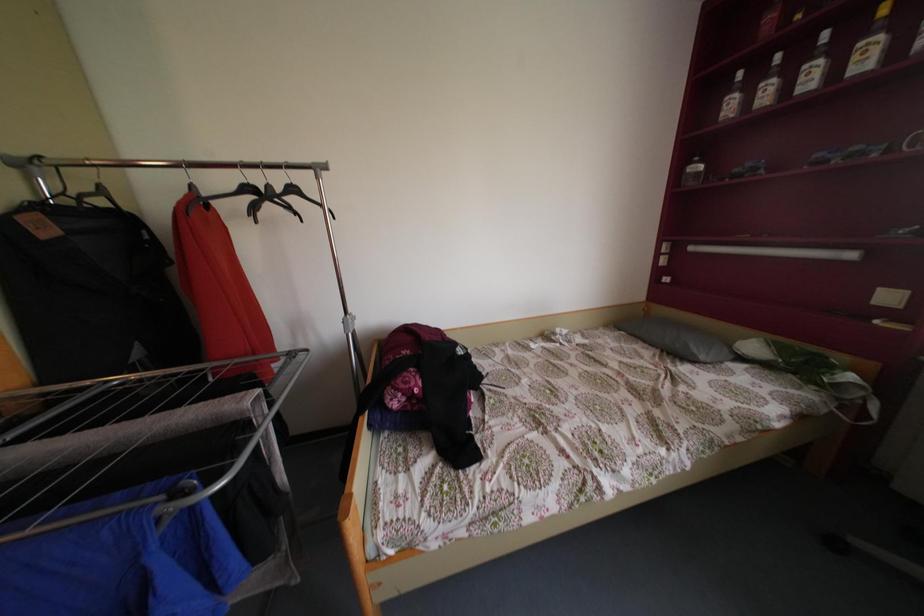
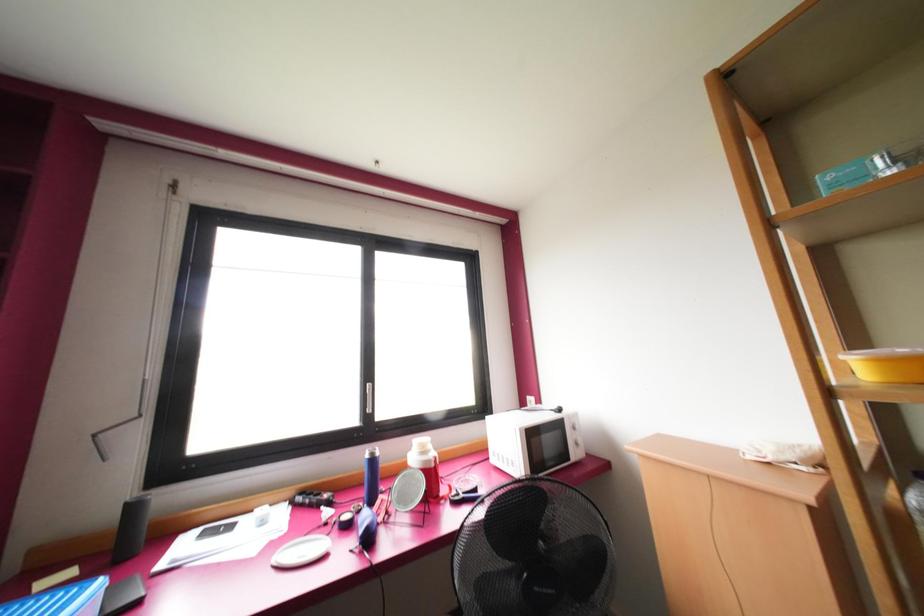
Question: The camera is either moving clockwise (left) or counter-clockwise (right) around the object. The first image is from the beginning of the video and the second image is from the end. Is the camera moving left or right when shooting the video?

Choices:
 (A) Left
 (B) Right

Answer: (A)